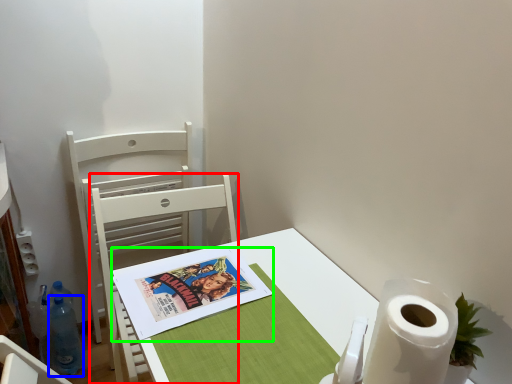
Question: Considering the real-world distances, which object is closest to chair (highlighted by a red box)? bottle (highlighted by a blue box) or comic book (highlighted by a green box).

Choices:
 (A) bottle
 (B) comic book

Answer: (B)